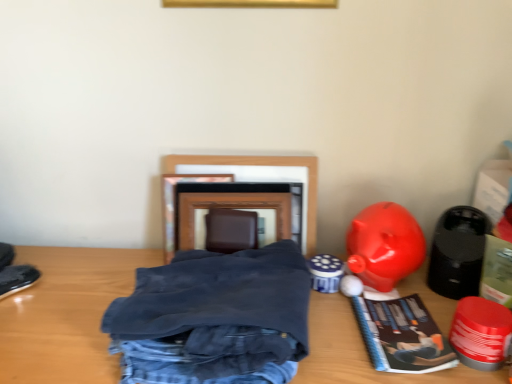
Question: Can wooden picture frame at center be found inside shiny red plastic toy at lower right, the second toy viewed from the left?

Choices:
 (A) no
 (B) yes

Answer: (A)

Question: Is there a large distance between shiny red plastic toy at lower right, the second toy viewed from the left, and wooden picture frame at center?

Choices:
 (A) yes
 (B) no

Answer: (B)

Question: Is shiny red plastic toy at lower right, the second toy from the right, facing towards wooden picture frame at center?

Choices:
 (A) no
 (B) yes

Answer: (A)

Question: Considering the relative sizes of shiny red plastic toy at lower right, the second toy from the right, and wooden picture frame at center in the image provided, is shiny red plastic toy at lower right, the second toy from the right, shorter than wooden picture frame at center?

Choices:
 (A) yes
 (B) no

Answer: (A)

Question: Is wooden picture frame at center at the back of shiny red plastic toy at lower right, the second toy viewed from the left?

Choices:
 (A) no
 (B) yes

Answer: (A)

Question: From their relative heights in the image, would you say dark blue cotton pants at center is taller or shorter than wooden picture frame at center?

Choices:
 (A) tall
 (B) short

Answer: (B)

Question: Is point (125, 347) positioned closer to the camera than point (309, 190)?

Choices:
 (A) closer
 (B) farther

Answer: (A)

Question: Looking at their shapes, would you say dark blue cotton pants at center is wider or thinner than wooden picture frame at center?

Choices:
 (A) thin
 (B) wide

Answer: (B)

Question: Considering the positions of dark blue cotton pants at center and wooden picture frame at center in the image, is dark blue cotton pants at center bigger or smaller than wooden picture frame at center?

Choices:
 (A) big
 (B) small

Answer: (A)

Question: Considering the positions of black matte speaker at right, the 1th toy viewed from the right, and dark blue cotton pants at center in the image, is black matte speaker at right, the 1th toy viewed from the right, wider or thinner than dark blue cotton pants at center?

Choices:
 (A) thin
 (B) wide

Answer: (A)

Question: Is black matte speaker at right, acting as the third toy starting from the left, in front of or behind dark blue cotton pants at center in the image?

Choices:
 (A) front
 (B) behind

Answer: (B)

Question: Considering the positions of black matte speaker at right, the 1th toy viewed from the right, and dark blue cotton pants at center in the image, is black matte speaker at right, the 1th toy viewed from the right, bigger or smaller than dark blue cotton pants at center?

Choices:
 (A) small
 (B) big

Answer: (A)

Question: Considering the relative positions of black matte speaker at right, acting as the third toy starting from the left, and dark blue cotton pants at center in the image provided, is black matte speaker at right, acting as the third toy starting from the left, to the left or to the right of dark blue cotton pants at center?

Choices:
 (A) left
 (B) right

Answer: (B)

Question: In terms of width, does shiny red plastic toy at lower right, the second toy from the right, look wider or thinner when compared to wooden table at center?

Choices:
 (A) wide
 (B) thin

Answer: (B)

Question: Looking at the image, does shiny red plastic toy at lower right, the second toy viewed from the left, seem bigger or smaller compared to wooden table at center?

Choices:
 (A) small
 (B) big

Answer: (A)